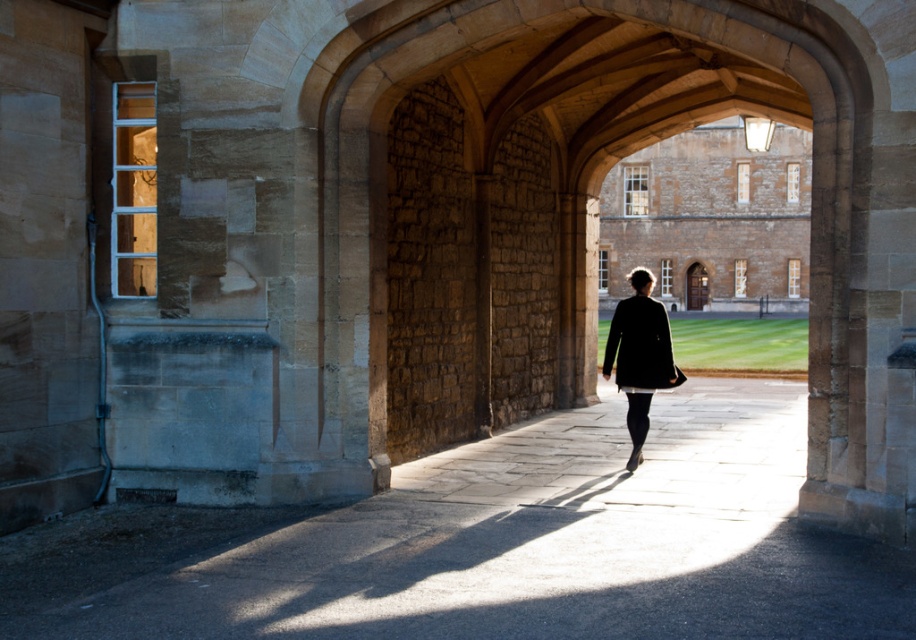
Question: Can you confirm if matte black coat at center is wider than black matte coat at center?

Choices:
 (A) yes
 (B) no

Answer: (A)

Question: Does smooth stone pathway at center lie in front of matte black coat at center?

Choices:
 (A) no
 (B) yes

Answer: (B)

Question: Among these objects, which one is nearest to the camera?

Choices:
 (A) matte black coat at center
 (B) black matte coat at center
 (C) smooth stone pathway at center

Answer: (C)

Question: Which of the following is the farthest from the observer?

Choices:
 (A) (646, 365)
 (B) (224, 579)

Answer: (A)

Question: Can you confirm if smooth stone pathway at center is wider than matte black coat at center?

Choices:
 (A) yes
 (B) no

Answer: (B)

Question: Among these objects, which one is farthest from the camera?

Choices:
 (A) black matte coat at center
 (B) smooth stone pathway at center
 (C) matte black coat at center

Answer: (C)